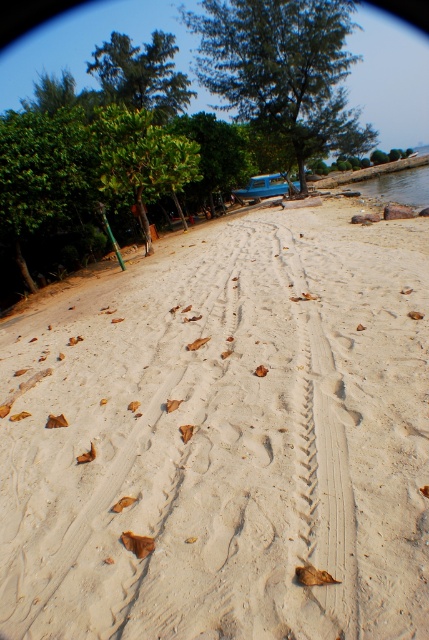
Question: From the image, what is the correct spatial relationship of green leafy tree at left in relation to green leafy tree at center?

Choices:
 (A) below
 (B) above

Answer: (A)

Question: Which point appears farthest from the camera in this image?

Choices:
 (A) (226, 186)
 (B) (123, 122)
 (C) (218, 227)
 (D) (256, 96)

Answer: (A)

Question: Is white sand tire tracks at center thinner than green leafy tree at upper center?

Choices:
 (A) yes
 (B) no

Answer: (A)

Question: Can you confirm if white sand tire tracks at center is positioned below green leafy tree at upper left?

Choices:
 (A) no
 (B) yes

Answer: (B)

Question: Which object is closer to the camera taking this photo?

Choices:
 (A) white sand tire tracks at center
 (B) green leafy tree at upper center

Answer: (A)

Question: Which point is farther from the camera taking this photo?

Choices:
 (A) (232, 76)
 (B) (93, 307)
 (C) (214, 150)
 (D) (178, 97)

Answer: (D)